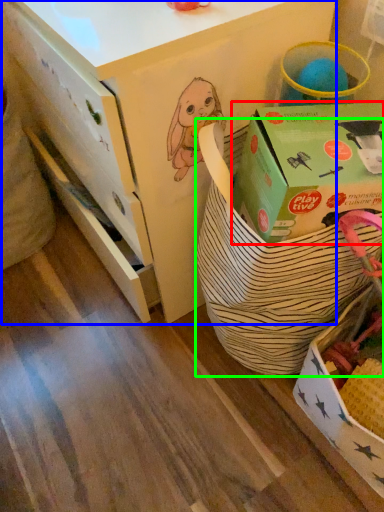
Question: Which object is the farthest from box (highlighted by a red box)? Choose among these: desk (highlighted by a blue box) or gift basket (highlighted by a green box).

Choices:
 (A) desk
 (B) gift basket

Answer: (A)